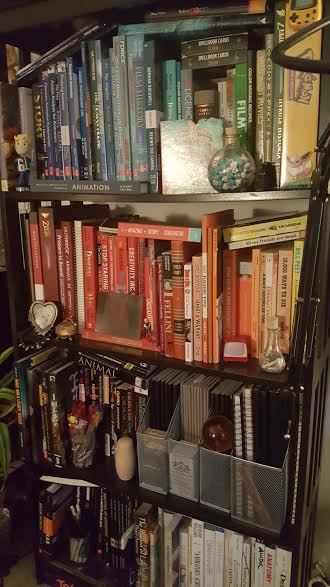
At what (x,y) coordinates should I click in order to perform the action: click on shelf. Please return your answer as a coordinate pair (x, y). Looking at the image, I should click on (191, 512), (203, 367), (87, 573), (171, 201).